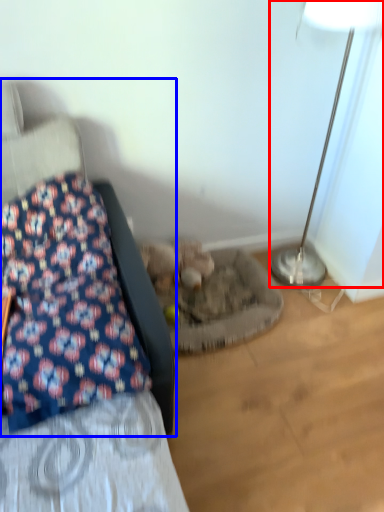
Question: Which object appears farthest to the camera in this image, lamp (highlighted by a red box) or furniture (highlighted by a blue box)?

Choices:
 (A) lamp
 (B) furniture

Answer: (A)